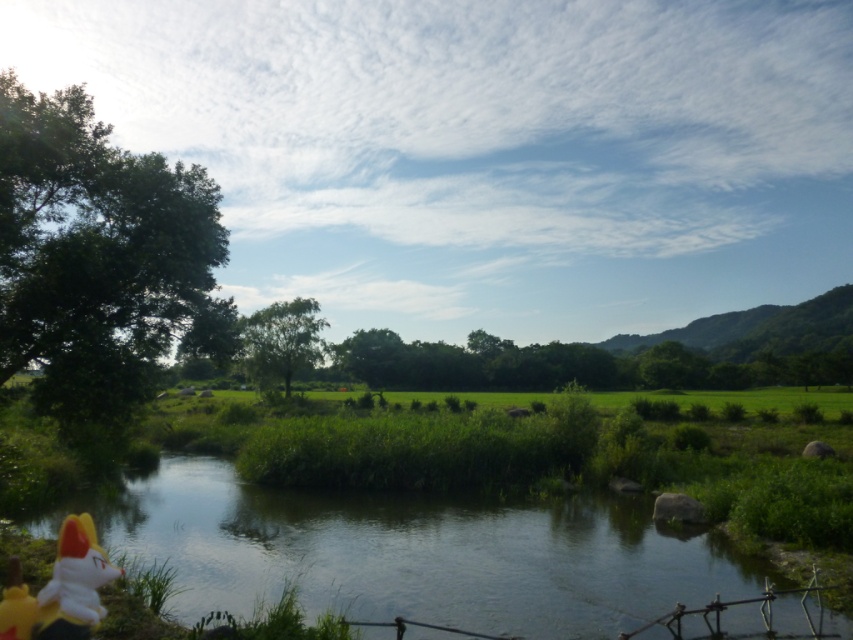
You are a hiker who wants to cross the green grassy river at lower center. You notice a green leafy tree at center nearby. Which direction should you walk to reach the tree from the river?

The green grassy river at lower center is positioned under the green leafy tree at center, so to reach the tree from the river, you should walk upward towards the tree.

You are a hiker who wants to cross the green grassy river at lower center and reach the green leafy tree at left. Based on the scene, which object is shorter and would be easier to step over?

The green grassy river at lower center has a lesser height compared to the green leafy tree at left, so the green grassy river at lower center is shorter and easier to step over.